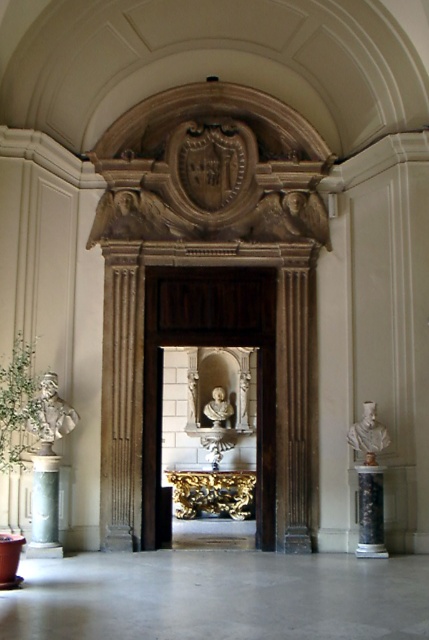
Question: Among these objects, which one is nearest to the camera?

Choices:
 (A) white marble bust at right
 (B) matte gray column at left

Answer: (B)

Question: In this image, where is blue marble column at right located relative to white marble bust at left?

Choices:
 (A) right
 (B) left

Answer: (A)

Question: Can you confirm if blue marble column at right is smaller than white marble bust at center?

Choices:
 (A) yes
 (B) no

Answer: (A)

Question: Is blue marble column at right wider than white marble bust at center?

Choices:
 (A) no
 (B) yes

Answer: (A)

Question: Which point is farther to the camera?

Choices:
 (A) (369, 416)
 (B) (224, 416)
 (C) (147, 356)
 (D) (33, 458)

Answer: (B)

Question: Among these points, which one is nearest to the camera?

Choices:
 (A) (377, 490)
 (B) (50, 381)
 (C) (223, 420)
 (D) (223, 346)

Answer: (A)